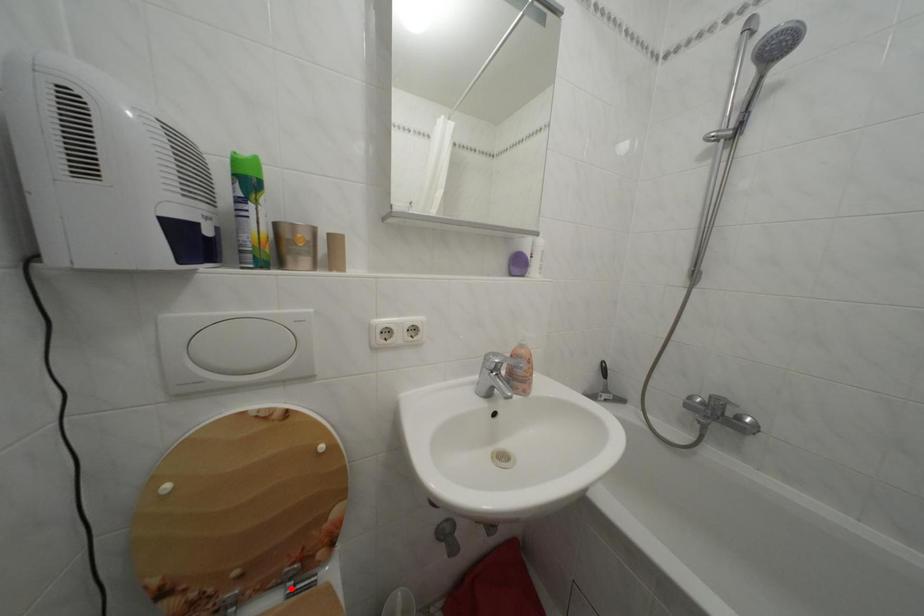
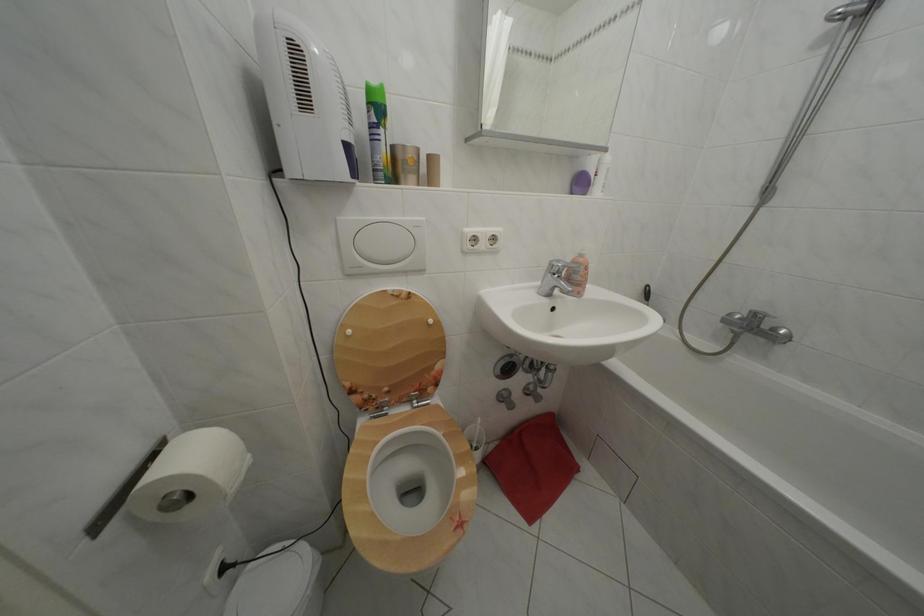
Where in the second image is the point corresponding to the highlighted location from the first image?

(419, 407)